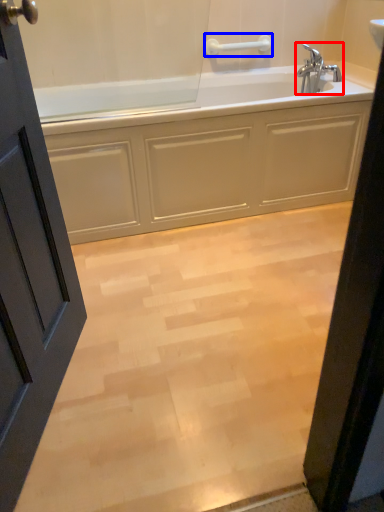
Question: Which object appears closest to the camera in this image, tap (highlighted by a red box) or towel bar (highlighted by a blue box)?

Choices:
 (A) tap
 (B) towel bar

Answer: (A)